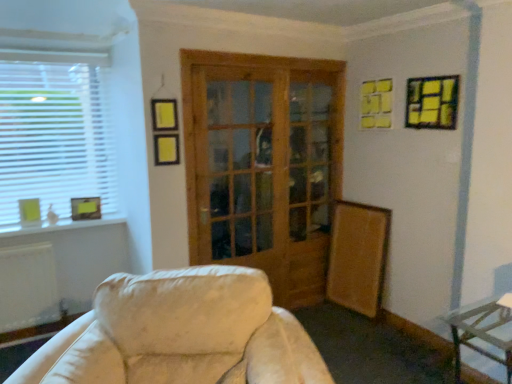
Where is `wooden glass door at center`? This screenshot has height=384, width=512. wooden glass door at center is located at coordinates (263, 164).

Where is `white plastic window at left`? white plastic window at left is located at coordinates (53, 132).

This screenshot has height=384, width=512. Describe the element at coordinates (481, 331) in the screenshot. I see `metallic silver table at lower right` at that location.

What do you see at coordinates (432, 102) in the screenshot?
I see `yellow paper picture frame at upper right, acting as the 3th picture frame starting from the back` at bounding box center [432, 102].

The image size is (512, 384). I want to click on wooden glass door at center, so click(x=263, y=164).

Measure the distance from matte yellow picture frame at left, acting as the third picture frame starting from the top, to metallic silver table at lower right.

matte yellow picture frame at left, acting as the third picture frame starting from the top, and metallic silver table at lower right are 2.91 meters apart.

Find the location of a particular element. the 2nd picture frame directly above the metallic silver table at lower right (from a real-world perspective) is located at coordinates (30, 212).

Are matte yellow picture frame at left, the 2th picture frame when ordered from back to front, and metallic silver table at lower right located far from each other?

matte yellow picture frame at left, the 2th picture frame when ordered from back to front, is far away from metallic silver table at lower right.

Is matte yellow picture frame at left, which is counted as the second picture frame, starting from the front, aimed at metallic silver table at lower right?

No, matte yellow picture frame at left, which is counted as the second picture frame, starting from the front, is not turned towards metallic silver table at lower right.

Between yellow paper picture frame at upper right, positioned as the first picture frame in right-to-left order, and wooden glass door at center, which one has smaller width?

With smaller width is wooden glass door at center.

From the image's perspective, is yellow paper picture frame at upper right, positioned as the third picture frame in bottom-to-top order, on top of wooden glass door at center?

Yes.

Considering their positions, is yellow paper picture frame at upper right, the first picture frame from the top, located in front of or behind wooden glass door at center?

yellow paper picture frame at upper right, the first picture frame from the top, is positioned closer to the viewer than wooden glass door at center.

Between metallic silver table at lower right and matte yellow picture frame at lower left, which is the 2th picture frame from right to left, which one has larger size?

With larger size is metallic silver table at lower right.

From the image's perspective, between metallic silver table at lower right and matte yellow picture frame at lower left, the second picture frame viewed from the top, which one is located above?

matte yellow picture frame at lower left, the second picture frame viewed from the top, appears higher in the image.

Is metallic silver table at lower right taller or shorter than matte yellow picture frame at lower left, marked as the 2th picture frame in a left-to-right arrangement?

metallic silver table at lower right is taller than matte yellow picture frame at lower left, marked as the 2th picture frame in a left-to-right arrangement.

From a real-world perspective, which object rests below the other?

From a 3D spatial view, metallic silver table at lower right is below.

Is matte yellow picture frame at lower left, marked as the 2th picture frame in a left-to-right arrangement, situated inside white plastic window at left or outside?

matte yellow picture frame at lower left, marked as the 2th picture frame in a left-to-right arrangement, cannot be found inside white plastic window at left.

Which is further, [71,211] or [98,168]?

The point [98,168] is behind.

How different are the orientations of matte yellow picture frame at lower left, which is the 2th picture frame from right to left, and white plastic window at left in degrees?

matte yellow picture frame at lower left, which is the 2th picture frame from right to left, and white plastic window at left are facing 7.37 degrees away from each other.

Does matte yellow picture frame at lower left, which is the 2th picture frame from right to left, have a lesser height compared to wooden glass door at center?

Indeed, matte yellow picture frame at lower left, which is the 2th picture frame from right to left, has a lesser height compared to wooden glass door at center.

From the picture: Between matte yellow picture frame at lower left, which is the first picture frame from back to front, and wooden glass door at center, which one has smaller width?

With smaller width is wooden glass door at center.

From a real-world perspective, who is located lower, matte yellow picture frame at lower left, which is the 2th picture frame from right to left, or wooden glass door at center?

matte yellow picture frame at lower left, which is the 2th picture frame from right to left, is physically lower.

Considering the positions of objects matte yellow picture frame at lower left, which is the 2th picture frame from right to left, and wooden glass door at center in the image provided, who is behind, matte yellow picture frame at lower left, which is the 2th picture frame from right to left, or wooden glass door at center?

matte yellow picture frame at lower left, which is the 2th picture frame from right to left.

Is metallic silver table at lower right thinner than wooden glass door at center?

In fact, metallic silver table at lower right might be wider than wooden glass door at center.

Which is closer to the camera, (476, 303) or (316, 158)?

Point (476, 303).

Does metallic silver table at lower right appear on the left side of wooden glass door at center?

A: Incorrect, metallic silver table at lower right is not on the left side of wooden glass door at center.

In the image, there is a wooden glass door at center. Identify the location of table below it (from a real-world perspective). (481, 331).

Is wooden glass door at center facing away from white plastic window at left?

No.

Measure the distance from wooden glass door at center to white plastic window at left.

wooden glass door at center and white plastic window at left are 1.25 meters apart from each other.

Does wooden glass door at center have a larger size compared to white plastic window at left?

Yes.

Does wooden glass door at center appear on the left side of white plastic window at left?

Incorrect, wooden glass door at center is not on the left side of white plastic window at left.

From the metallic silver table at lower right, count the 3rd picture frame to the left and point to it. Please provide its 2D coordinates.

[(30, 212)]

Where is `picture frame on the right of wooden glass door at center`? picture frame on the right of wooden glass door at center is located at coordinates (432, 102).

From the image, which object appears to be nearer to yellow paper picture frame at upper right, the first picture frame from the top, matte yellow picture frame at left, the third picture frame from the right, or white plastic window at left?

white plastic window at left lies closer to yellow paper picture frame at upper right, the first picture frame from the top, than the other object.

Based on their spatial positions, is white plastic window at left or wooden glass door at center further from matte yellow picture frame at left, acting as the third picture frame starting from the top?

wooden glass door at center lies further to matte yellow picture frame at left, acting as the third picture frame starting from the top, than the other object.

Which object lies further to the anchor point matte yellow picture frame at lower left, the 2th picture frame from the bottom, yellow paper picture frame at upper right, acting as the 3th picture frame starting from the back, or white plastic window at left?

The object further to matte yellow picture frame at lower left, the 2th picture frame from the bottom, is yellow paper picture frame at upper right, acting as the 3th picture frame starting from the back.

Based on their spatial positions, is matte yellow picture frame at lower left, which is the first picture frame from back to front, or white plastic window at left further from yellow paper picture frame at upper right, positioned as the first picture frame in right-to-left order?

Based on the image, matte yellow picture frame at lower left, which is the first picture frame from back to front, appears to be further to yellow paper picture frame at upper right, positioned as the first picture frame in right-to-left order.

Which object lies further to the anchor point yellow paper picture frame at upper right, placed as the 1th picture frame when sorted from front to back, metallic silver table at lower right or matte yellow picture frame at left, the first picture frame when ordered from bottom to top?

matte yellow picture frame at left, the first picture frame when ordered from bottom to top, is further to yellow paper picture frame at upper right, placed as the 1th picture frame when sorted from front to back.

From the image, which object appears to be nearer to matte yellow picture frame at lower left, the 2th picture frame from the bottom, matte yellow picture frame at left, the 2th picture frame when ordered from back to front, or white plastic window at left?

matte yellow picture frame at left, the 2th picture frame when ordered from back to front.

Estimate the real-world distances between objects in this image. Which object is further from yellow paper picture frame at upper right, positioned as the third picture frame in bottom-to-top order, white plastic window at left or matte yellow picture frame at left, the first picture frame from the left?

matte yellow picture frame at left, the first picture frame from the left.

From the image, which object appears to be farther from white plastic window at left, matte yellow picture frame at lower left, marked as the 2th picture frame in a left-to-right arrangement, or yellow paper picture frame at upper right, positioned as the first picture frame in right-to-left order?

The object further to white plastic window at left is yellow paper picture frame at upper right, positioned as the first picture frame in right-to-left order.

This screenshot has width=512, height=384. I want to click on door situated between matte yellow picture frame at lower left, which is the first picture frame from back to front, and metallic silver table at lower right from left to right, so click(x=263, y=164).

You are a GUI agent. You are given a task and a screenshot of the screen. Output one action in this format:
    pyautogui.click(x=<x>, y=<y>)
    Task: Click on the door between white plastic window at left and yellow paper picture frame at upper right, which appears as the 3th picture frame when viewed from the left
    
    Given the screenshot: What is the action you would take?
    pyautogui.click(x=263, y=164)

Where is `picture frame located between matte yellow picture frame at left, acting as the third picture frame starting from the top, and yellow paper picture frame at upper right, placed as the 1th picture frame when sorted from front to back, in the left-right direction`? The width and height of the screenshot is (512, 384). picture frame located between matte yellow picture frame at left, acting as the third picture frame starting from the top, and yellow paper picture frame at upper right, placed as the 1th picture frame when sorted from front to back, in the left-right direction is located at coordinates (85, 208).

This screenshot has width=512, height=384. Identify the location of picture frame between white plastic window at left and matte yellow picture frame at left, acting as the third picture frame starting from the top, in the up-down direction. (85, 208).